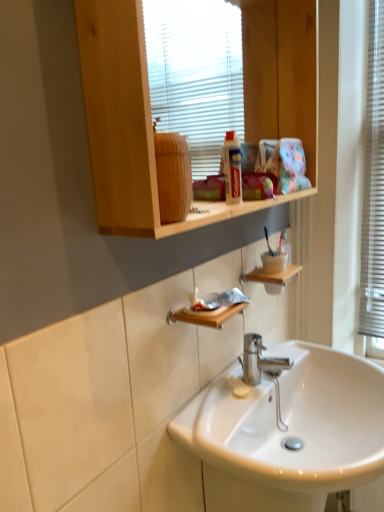
The width and height of the screenshot is (384, 512). Describe the element at coordinates (373, 183) in the screenshot. I see `white plastic window frame at right` at that location.

Describe the element at coordinates (206, 316) in the screenshot. I see `wooden soap dish at lower center, the 1th shelf in the bottom-to-top sequence` at that location.

Describe the element at coordinates (288, 432) in the screenshot. I see `white glossy sink at center` at that location.

Identify the location of wooden shelf at lower center, acting as the second shelf starting from the left. (270, 275).

Does wooden soap dish at lower center, arranged as the 2th shelf when viewed from the back, have a larger size compared to white glossy sink at center?

A: Actually, wooden soap dish at lower center, arranged as the 2th shelf when viewed from the back, might be smaller than white glossy sink at center.

Considering the points (172, 310) and (336, 416), which point is in front, point (172, 310) or point (336, 416)?

Positioned in front is point (172, 310).

From a real-world perspective, who is located lower, wooden soap dish at lower center, the first shelf viewed from the front, or white glossy sink at center?

From a 3D spatial view, white glossy sink at center is below.

Could you tell me if wooden soap dish at lower center, positioned as the second shelf in top-to-bottom order, is facing white glossy sink at center?

No.

Who is taller, white plastic window frame at right or wooden soap dish at lower center, the 2th shelf when ordered from right to left?

Standing taller between the two is white plastic window frame at right.

From the image's perspective, which one is positioned higher, white plastic window frame at right or wooden soap dish at lower center, the first shelf viewed from the front?

white plastic window frame at right is shown above in the image.

Which object is further away from the camera, white plastic window frame at right or wooden soap dish at lower center, arranged as the 2th shelf when viewed from the back?

white plastic window frame at right is more distant.

Which is in front, wooden soap dish at lower center, arranged as the 2th shelf when viewed from the back, or wooden shelf at lower center, acting as the second shelf starting from the left?

wooden soap dish at lower center, arranged as the 2th shelf when viewed from the back, is more forward.

Is wooden soap dish at lower center, the 1th shelf in the left-to-right sequence, oriented away from wooden shelf at lower center, acting as the second shelf starting from the left?

No, wooden soap dish at lower center, the 1th shelf in the left-to-right sequence, is not facing the opposite direction of wooden shelf at lower center, acting as the second shelf starting from the left.

From the picture: Is wooden soap dish at lower center, arranged as the 2th shelf when viewed from the back, to the left or to the right of wooden shelf at lower center, which is counted as the second shelf, starting from the bottom, in the image?

In the image, wooden soap dish at lower center, arranged as the 2th shelf when viewed from the back, appears on the left side of wooden shelf at lower center, which is counted as the second shelf, starting from the bottom.

From a real-world perspective, is wooden soap dish at lower center, positioned as the second shelf in top-to-bottom order, positioned above or below wooden shelf at lower center, which is the 1th shelf in back-to-front order?

From a real-world perspective, wooden soap dish at lower center, positioned as the second shelf in top-to-bottom order, is physically above wooden shelf at lower center, which is the 1th shelf in back-to-front order.

In the scene shown: From a real-world perspective, is wooden soap dish at lower center, the 1th shelf in the left-to-right sequence, positioned under wooden shelf at upper center based on gravity?

Indeed, from a real-world perspective, wooden soap dish at lower center, the 1th shelf in the left-to-right sequence, is positioned beneath wooden shelf at upper center.

Does wooden soap dish at lower center, the first shelf viewed from the front, lie in front of wooden shelf at upper center?

No, the depth of wooden soap dish at lower center, the first shelf viewed from the front, is greater than that of wooden shelf at upper center.

Between wooden soap dish at lower center, the 2th shelf when ordered from right to left, and wooden shelf at upper center, which one has less height?

wooden soap dish at lower center, the 2th shelf when ordered from right to left.

Is wooden soap dish at lower center, the 1th shelf in the bottom-to-top sequence, facing away from wooden shelf at upper center?

No, wooden soap dish at lower center, the 1th shelf in the bottom-to-top sequence, is not facing away from wooden shelf at upper center.

Which is in front, wooden shelf at lower center, which is counted as the second shelf, starting from the bottom, or white plastic window frame at right?

wooden shelf at lower center, which is counted as the second shelf, starting from the bottom.

The image size is (384, 512). In order to click on the 1st shelf counting from the left of the white plastic window frame at right in this screenshot , I will do [x=270, y=275].

Is wooden shelf at lower center, the first shelf viewed from the top, next to white plastic window frame at right?

There is a gap between wooden shelf at lower center, the first shelf viewed from the top, and white plastic window frame at right.

In terms of width, does wooden shelf at lower center, which is the 1th shelf in back-to-front order, look wider or thinner when compared to white plastic window frame at right?

In the image, wooden shelf at lower center, which is the 1th shelf in back-to-front order, appears to be wider than white plastic window frame at right.

Can you confirm if wooden shelf at upper center is taller than wooden soap dish at lower center, the 1th shelf in the bottom-to-top sequence?

Correct, wooden shelf at upper center is much taller as wooden soap dish at lower center, the 1th shelf in the bottom-to-top sequence.

From a real-world perspective, is wooden shelf at upper center on wooden soap dish at lower center, the 2th shelf when ordered from right to left?

Correct, in the physical world, wooden shelf at upper center is higher than wooden soap dish at lower center, the 2th shelf when ordered from right to left.

There is a wooden shelf at upper center. Where is `the 1st shelf below it (from a real-world perspective)`? This screenshot has height=512, width=384. the 1st shelf below it (from a real-world perspective) is located at coordinates (206, 316).

Is wooden soap dish at lower center, arranged as the 2th shelf when viewed from the back, inside wooden shelf at upper center?

No, wooden soap dish at lower center, arranged as the 2th shelf when viewed from the back, is not inside wooden shelf at upper center.

Between white glossy sink at center and wooden shelf at lower center, the second shelf in the front-to-back sequence, which one is positioned behind?

wooden shelf at lower center, the second shelf in the front-to-back sequence, is further from the camera.

From a real-world perspective, which object rests below the other?

white glossy sink at center, from a real-world perspective.

Who is bigger, white glossy sink at center or wooden shelf at lower center, which is the first shelf in right-to-left order?

white glossy sink at center.

From the image's perspective, between white glossy sink at center and wooden shelf at lower center, the first shelf viewed from the top, who is located below?

white glossy sink at center.

Locate an element on the screen. sink in front of the wooden soap dish at lower center, the first shelf viewed from the front is located at coordinates (288, 432).

Where is `window frame to the right of wooden soap dish at lower center, arranged as the 2th shelf when viewed from the back`? Image resolution: width=384 pixels, height=512 pixels. window frame to the right of wooden soap dish at lower center, arranged as the 2th shelf when viewed from the back is located at coordinates (373, 183).

Looking at this image, which object lies nearer to the anchor point wooden soap dish at lower center, positioned as the second shelf in top-to-bottom order, wooden shelf at upper center or white glossy sink at center?

white glossy sink at center is positioned closer to the anchor wooden soap dish at lower center, positioned as the second shelf in top-to-bottom order.

Based on their spatial positions, is white glossy sink at center or white plastic window frame at right further from wooden soap dish at lower center, positioned as the second shelf in top-to-bottom order?

white plastic window frame at right.

When comparing their distances from wooden soap dish at lower center, the first shelf viewed from the front, does white glossy sink at center or wooden shelf at upper center seem further?

The object further to wooden soap dish at lower center, the first shelf viewed from the front, is wooden shelf at upper center.

Looking at this image, when comparing their distances from white plastic window frame at right, does wooden soap dish at lower center, the 2th shelf when ordered from right to left, or white glossy sink at center seem further?

wooden soap dish at lower center, the 2th shelf when ordered from right to left, lies further to white plastic window frame at right than the other object.

From the picture: Considering their positions, is wooden soap dish at lower center, the 1th shelf in the left-to-right sequence, positioned closer to white plastic window frame at right than wooden shelf at upper center?

wooden shelf at upper center.

When comparing their distances from wooden soap dish at lower center, the 1th shelf in the left-to-right sequence, does wooden shelf at lower center, the first shelf viewed from the top, or wooden shelf at upper center seem closer?

The object closer to wooden soap dish at lower center, the 1th shelf in the left-to-right sequence, is wooden shelf at lower center, the first shelf viewed from the top.

Considering their positions, is white glossy sink at center positioned further to white plastic window frame at right than wooden shelf at upper center?

white glossy sink at center is further to white plastic window frame at right.

From the image, which object appears to be nearer to white plastic window frame at right, wooden shelf at lower center, acting as the second shelf starting from the left, or wooden soap dish at lower center, the 2th shelf when ordered from right to left?

The object closer to white plastic window frame at right is wooden shelf at lower center, acting as the second shelf starting from the left.

Locate an element on the screen. The width and height of the screenshot is (384, 512). shelf between wooden soap dish at lower center, the 2th shelf when ordered from right to left, and white plastic window frame at right, in the horizontal direction is located at coordinates click(x=270, y=275).

Find the location of a particular element. Image resolution: width=384 pixels, height=512 pixels. shelf that lies between wooden shelf at lower center, the first shelf viewed from the top, and white glossy sink at center from top to bottom is located at coordinates (206, 316).

In order to click on shelf positioned between wooden shelf at upper center and wooden shelf at lower center, the first shelf viewed from the top, from near to far in this screenshot , I will do `click(206, 316)`.

Locate an element on the screen. The height and width of the screenshot is (512, 384). window frame between wooden shelf at upper center and white glossy sink at center from top to bottom is located at coordinates (373, 183).